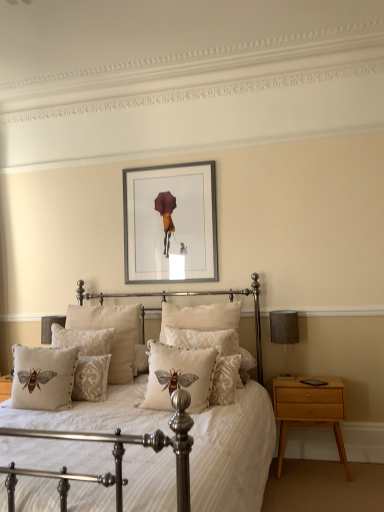
Question: From a real-world perspective, is white textured pillow with bee design at center, arranged as the 4th pillow when viewed from the back, above or below beige damask pillow at center, positioned as the fifth pillow in front-to-back order?

Choices:
 (A) above
 (B) below

Answer: (B)

Question: Considering their positions, is white textured pillow with bee design at center, arranged as the 4th pillow when viewed from the back, located in front of or behind beige damask pillow at center, positioned as the fifth pillow in front-to-back order?

Choices:
 (A) behind
 (B) front

Answer: (B)

Question: Which object is the closest to the white textured pillow with bee design at center, arranged as the 4th pillow when viewed from the back?

Choices:
 (A) textured gray lampshade at right
 (B) beige damask pillow with bee design at center, positioned as the 4th pillow in front-to-back order
 (C) beige damask pillow at center, the 6th pillow from the front
 (D) beige embroidered pillow with bee design at center, which ranks as the 1th pillow in front-to-back order
 (E) light brown wood nightstand at right

Answer: (B)

Question: Which of these objects is positioned closest to the silver metallic picture frame at upper center?

Choices:
 (A) light brown wood nightstand at right
 (B) beige damask pillow with bee design at center, positioned as the 4th pillow in front-to-back order
 (C) beige embroidered cushion with bee design at center, the 5th pillow positioned from the back
 (D) beige damask pillow at center, positioned as the fifth pillow in front-to-back order
 (E) beige embroidered pillow with bee design at center, which is the sixth pillow from back to front

Answer: (B)